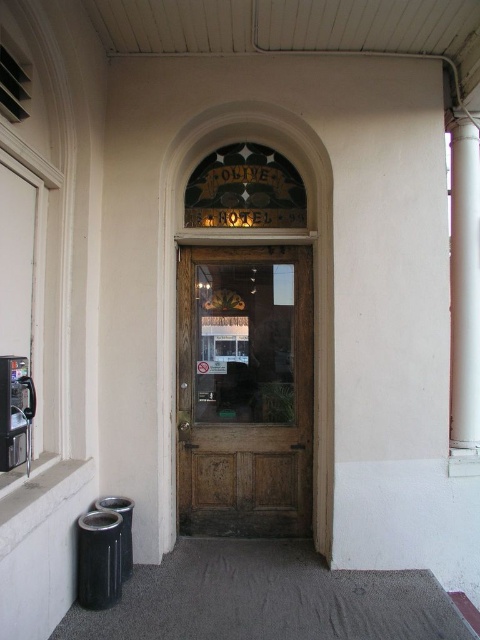
You are standing at the entrance of the building and want to locate the wooden door at center. Where exactly is it located in relation to the point marked at coordinates (x=244, y=390)?

The wooden door at center is located exactly at the point marked at coordinates (x=244, y=390).

You are a delivery person trying to enter the Olive Hotel. You see the wooden door at center and the white smooth pillar at right. Which object is bigger in size?

The wooden door at center is larger in size than the white smooth pillar at right.